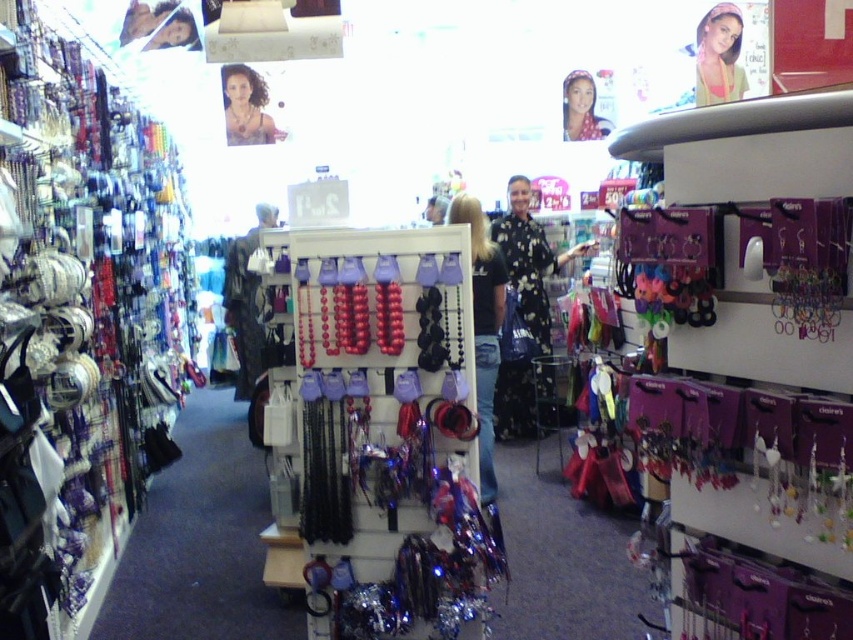
Question: Which point is farther to the camera?

Choices:
 (A) floral-patterned dress at center
 (B) shiny metallic beads at center

Answer: (A)

Question: Which point appears closest to the camera in this image?

Choices:
 (A) (224, 70)
 (B) (503, 294)

Answer: (B)

Question: Where is black matte necklace at center located in relation to matte gold necklace at upper center in the image?

Choices:
 (A) left
 (B) right

Answer: (B)

Question: Can you confirm if matte pink hairband at upper center is thinner than matte black hair at upper left?

Choices:
 (A) no
 (B) yes

Answer: (A)

Question: Is floral-patterned dress at center to the right of matte gold necklace at upper center from the viewer's perspective?

Choices:
 (A) yes
 (B) no

Answer: (A)

Question: Based on their relative distances, which object is farther from the shiny metallic beads at center?

Choices:
 (A) metallic silver necklaces at left
 (B) floral-patterned dress at center
 (C) matte black hair at upper center

Answer: (C)